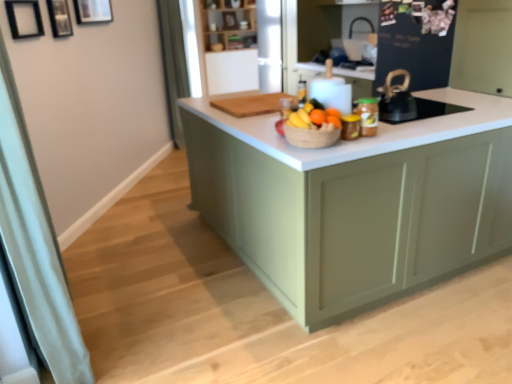
The height and width of the screenshot is (384, 512). I want to click on vacant area that lies to the right of white fabric curtain at left, positioned as the second curtain in back-to-front order, so click(180, 329).